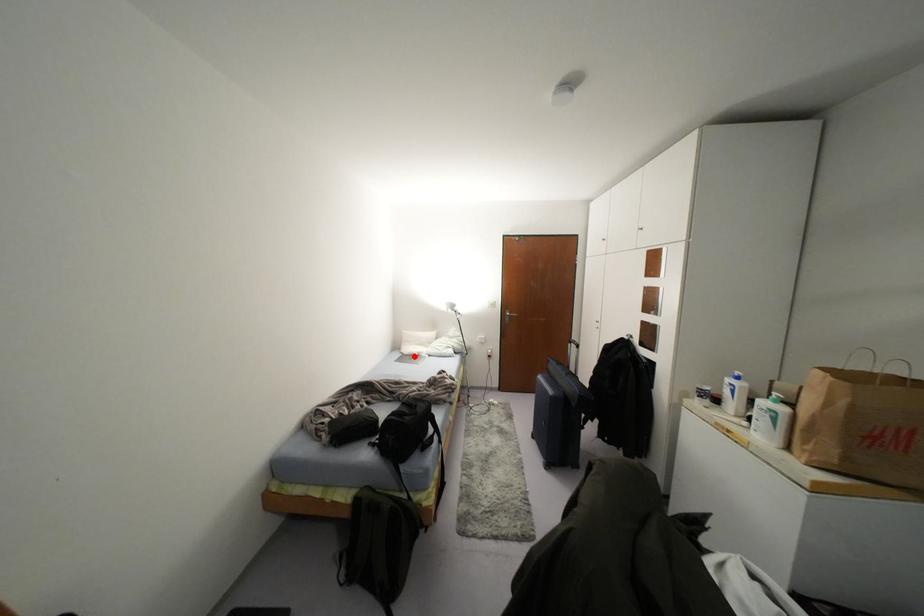
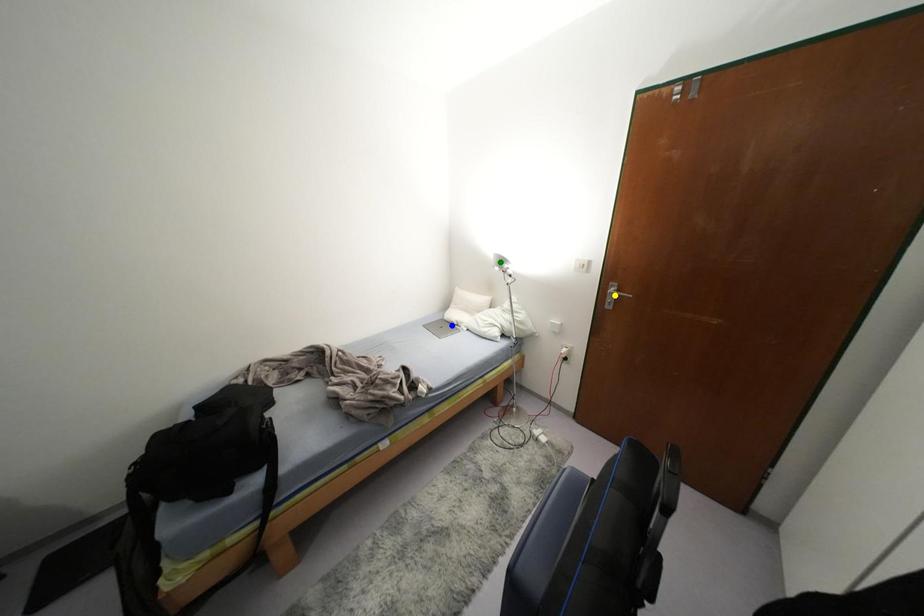
Question: I am providing you with two images of the same scene from different viewpoints. A red point is marked on the first image. You are given multiple points on the second image. Which point in image 2 is actually the same real-world point as the red point in image 1?

Choices:
 (A) yellow point
 (B) green point
 (C) blue point

Answer: (C)